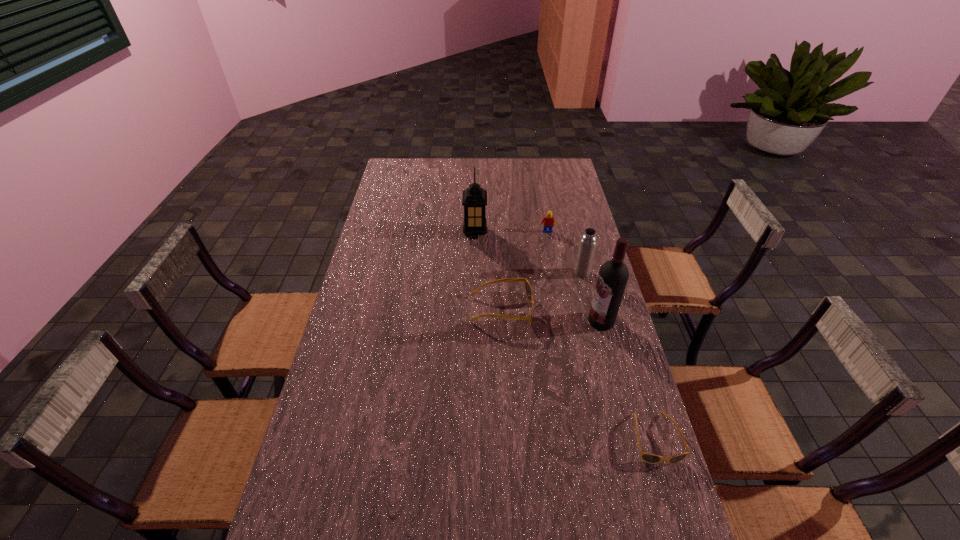
Where is `vacant region located 0.180m on the front-facing side of the second shortest object`? vacant region located 0.180m on the front-facing side of the second shortest object is located at coordinates (586, 310).

Locate an element on the screen. This screenshot has width=960, height=540. vacant space located on the front-facing side of the shortest object is located at coordinates (669, 485).

Identify the location of free spot located on the front of the second tallest object. This screenshot has width=960, height=540. (474, 265).

Identify the location of vacant space located 0.100m on the front-facing side of the fourth object from right to left. Image resolution: width=960 pixels, height=540 pixels. (550, 250).

The image size is (960, 540). I want to click on vacant space located on the label of the wine bottle, so 509,321.

Locate an element on the screen. The width and height of the screenshot is (960, 540). vacant area located 0.050m on the label of the wine bottle is located at coordinates (573, 321).

Identify the location of free location located on the label of the wine bottle. Image resolution: width=960 pixels, height=540 pixels. (521, 321).

Image resolution: width=960 pixels, height=540 pixels. Find the location of `blank area located 0.110m on the back of the fourth nearest object`. blank area located 0.110m on the back of the fourth nearest object is located at coordinates (576, 249).

Identify the location of sunglasses that is at the right edge. This screenshot has width=960, height=540. (650, 458).

At what (x,y) coordinates should I click in order to perform the action: click on Lego that is at the right edge. Please return your answer as a coordinate pair (x, y). The height and width of the screenshot is (540, 960). Looking at the image, I should click on (548, 221).